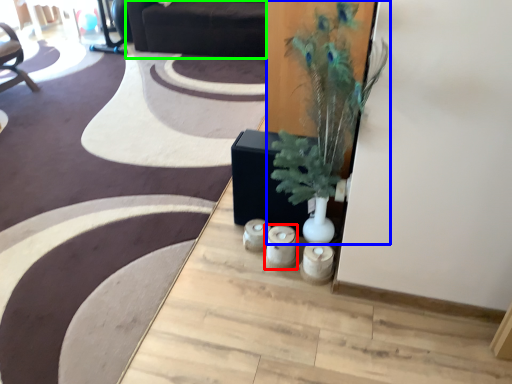
Question: Considering the real-world distances, which object is farthest from candle holder (highlighted by a red box)? houseplant (highlighted by a blue box) or couch (highlighted by a green box)?

Choices:
 (A) houseplant
 (B) couch

Answer: (B)